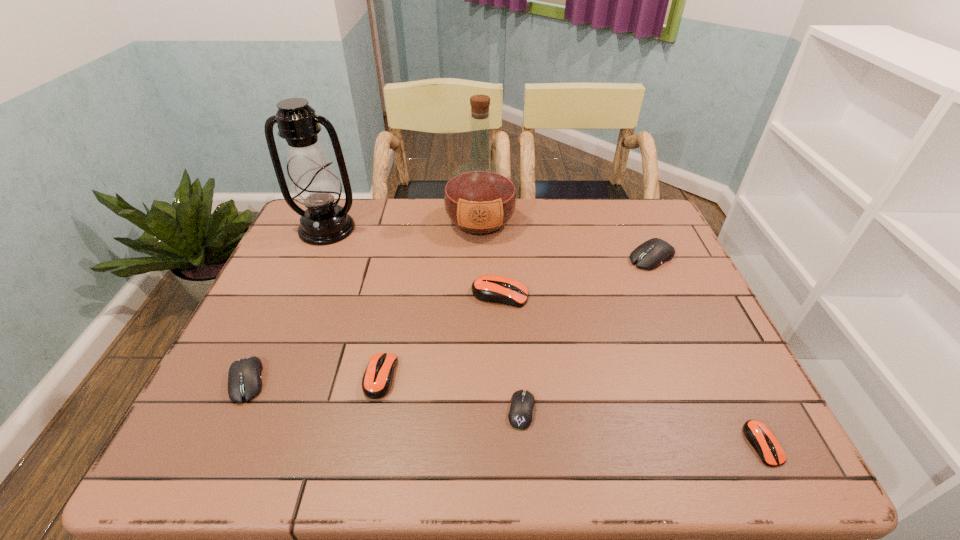
At what (x,y) coordinates should I click in order to perform the action: click on free space between the second nearest orange computer mouse and the leftmost black computer equipment. Please return your answer as a coordinate pair (x, y). Looking at the image, I should click on (314, 379).

You are a GUI agent. You are given a task and a screenshot of the screen. Output one action in this format:
    pyautogui.click(x=<x>, y=<y>)
    Task: Click on the object that is the closest to the sixth object from right to left
    The width and height of the screenshot is (960, 540).
    Given the screenshot: What is the action you would take?
    pyautogui.click(x=244, y=377)

Identify the location of the third closest object relative to the smallest orange computer mouse. (489, 288).

Identify which computer mouse is the fourth nearest to the rightmost black computer equipment. Please provide its 2D coordinates. Your answer should be formatted as a tuple, i.e. [(x, y)], where the tuple contains the x and y coordinates of a point satisfying the conditions above.

[(377, 380)]

Find the location of a particular element. The image size is (960, 540). computer mouse that is the fifth nearest to the oil lamp is located at coordinates (649, 255).

Point out which black computer equipment is positioned as the third nearest to the leftmost orange computer mouse. Please provide its 2D coordinates. Your answer should be formatted as a tuple, i.e. [(x, y)], where the tuple contains the x and y coordinates of a point satisfying the conditions above.

[(649, 255)]

This screenshot has width=960, height=540. I want to click on black computer equipment identified as the closest to the second smallest black computer equipment, so click(522, 403).

Where is `orange computer mouse identified as the closest to the black oil lamp`? This screenshot has height=540, width=960. orange computer mouse identified as the closest to the black oil lamp is located at coordinates (489, 288).

Select which orange computer mouse is the second closest to the sixth object from right to left. Please provide its 2D coordinates. Your answer should be formatted as a tuple, i.e. [(x, y)], where the tuple contains the x and y coordinates of a point satisfying the conditions above.

[(762, 439)]

Image resolution: width=960 pixels, height=540 pixels. Identify the location of free space that satisfies the following two spatial constraints: 1. on the front side of the fifth computer mouse from right to left; 2. on the right side of the smallest black computer equipment. (374, 410).